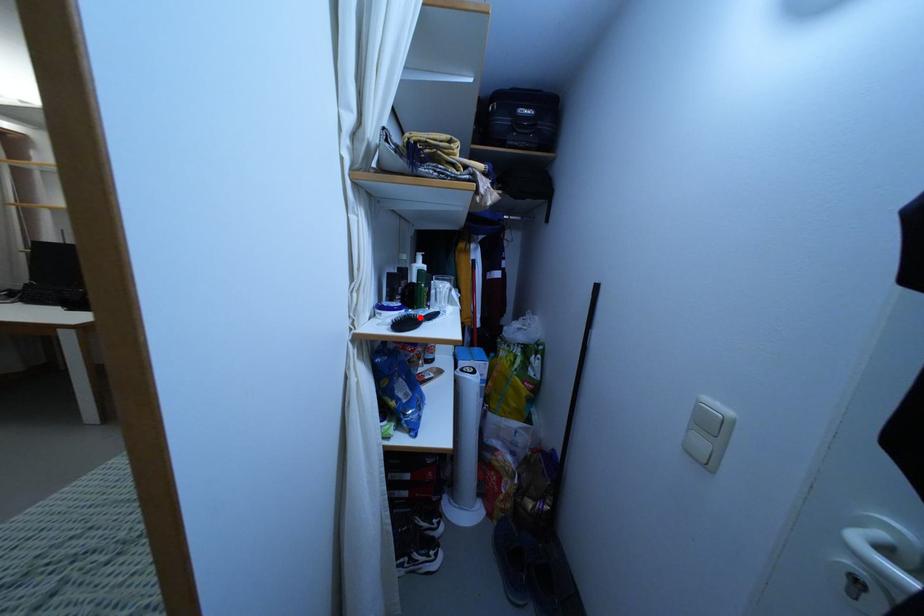
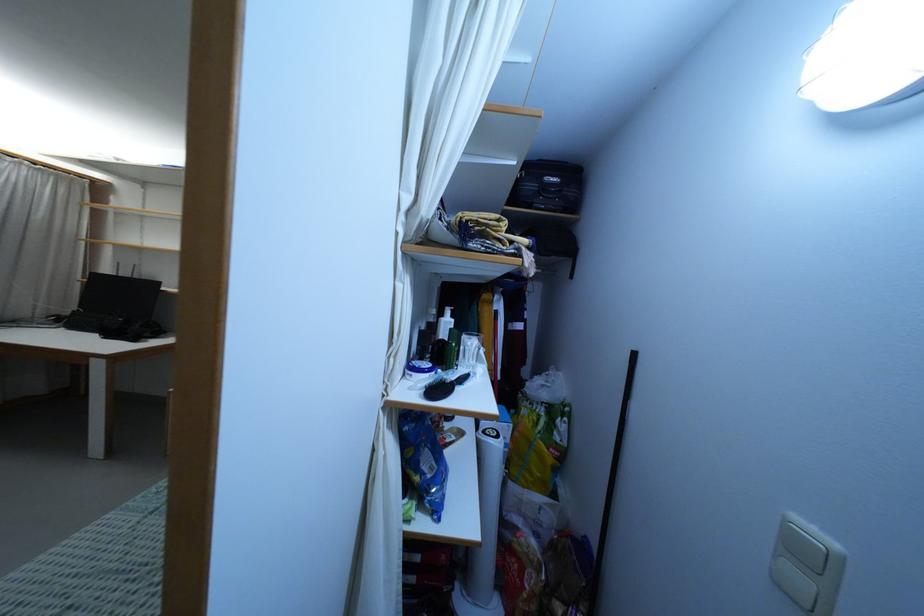
In the second image, find the point that corresponds to the highlighted location in the first image.

(452, 382)